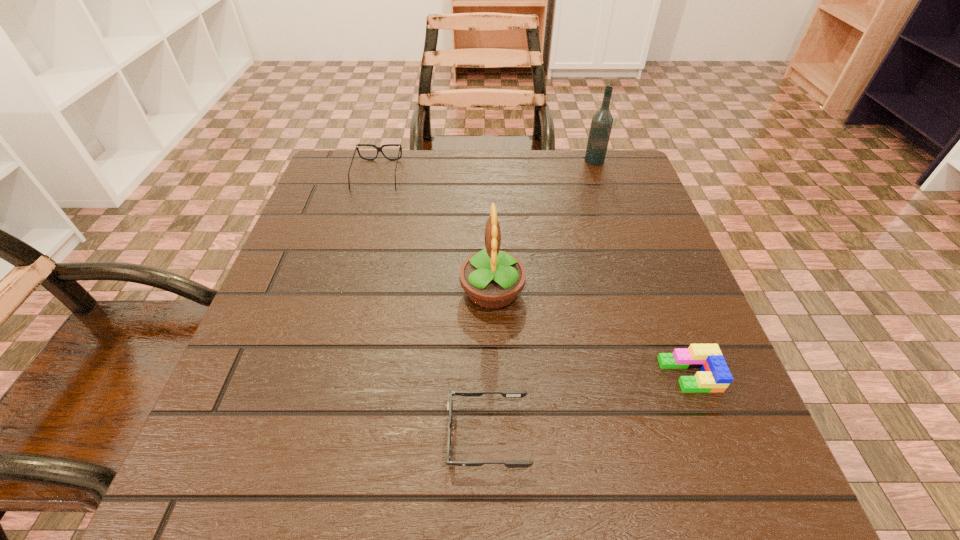
Identify the location of free space between the vodka and the spectacles. This screenshot has width=960, height=540. (486, 167).

The image size is (960, 540). In order to click on free space between the spectacles and the vodka in this screenshot , I will do `click(486, 167)`.

Where is `free space that is in between the sunflower and the fourth farthest object`? free space that is in between the sunflower and the fourth farthest object is located at coordinates (590, 333).

The height and width of the screenshot is (540, 960). Identify the location of unoccupied position between the leftmost object and the shortest object. (432, 305).

Locate an element on the screen. Image resolution: width=960 pixels, height=540 pixels. free point between the vodka and the spectacles is located at coordinates (486, 167).

Locate an element on the screen. Image resolution: width=960 pixels, height=540 pixels. free space between the sunflower and the Lego is located at coordinates (590, 333).

Where is `vacant point located between the shortest object and the Lego`? vacant point located between the shortest object and the Lego is located at coordinates (588, 405).

This screenshot has width=960, height=540. Identify the location of free area in between the Lego and the leftmost object. (534, 275).

Where is `unoccupied area between the sunglasses and the leftmost object`? unoccupied area between the sunglasses and the leftmost object is located at coordinates (432, 305).

This screenshot has height=540, width=960. In order to click on empty space that is in between the spectacles and the sunflower in this screenshot , I will do `click(435, 233)`.